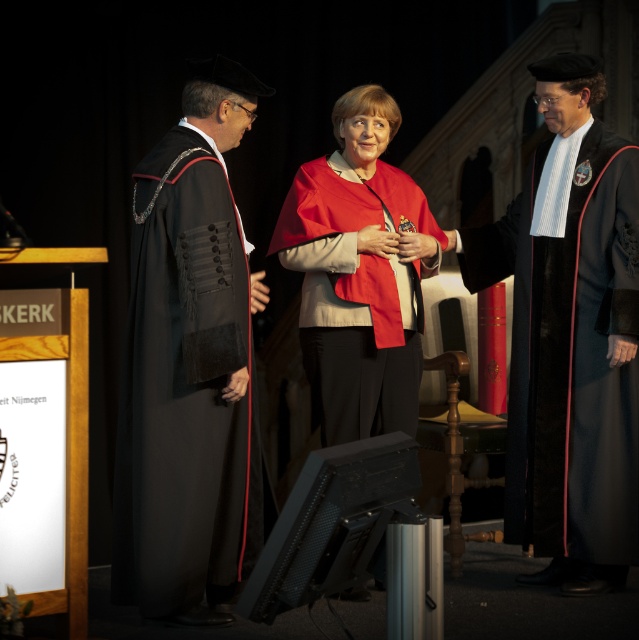
You are an event organizer who needs to arrange seating for the participants. The black velvet gown at left and the matte red cape at center are both present. Which one requires a wider seat due to their attire?

The matte red cape at center requires a wider seat because its width is greater than the black velvet gown at left.

You are standing in the front row of the ceremony. There is a black velvet gown at right represented by point (571, 356). Where is the black velvet gown at right located in relation to your position?

The black velvet gown at right is located at the coordinates (571, 356), which is to the right side of the image from your perspective.

Based on the photo, you are attending a formal ceremony and notice two attendees dressed in distinctive attire. The black velvet gown at left and the matte red cape at center. From your vantage point, which of these two garments appears closer to the front of the stage?

The black velvet gown at left appears closer to the front of the stage because it is positioned below the matte red cape at center, indicating it is in a lower, more forward position.